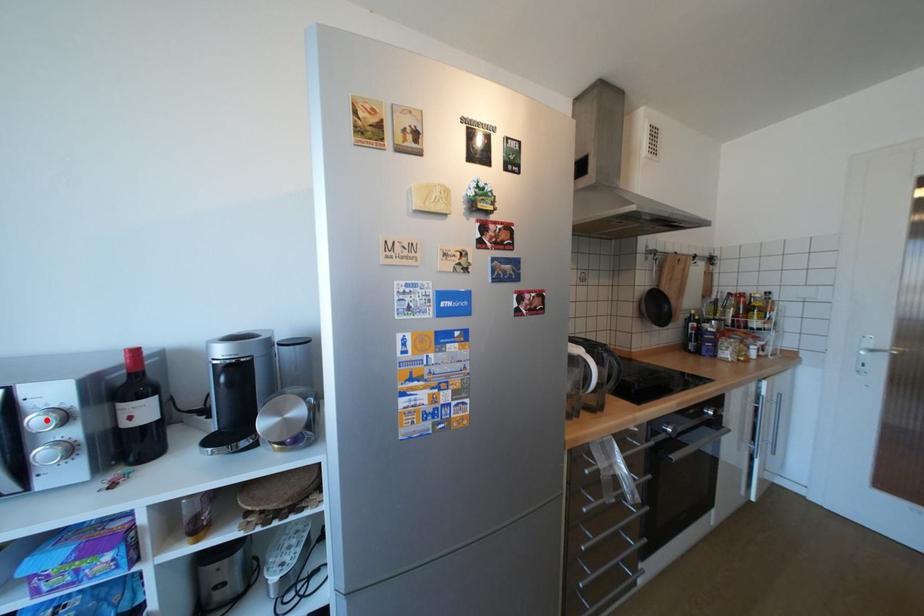
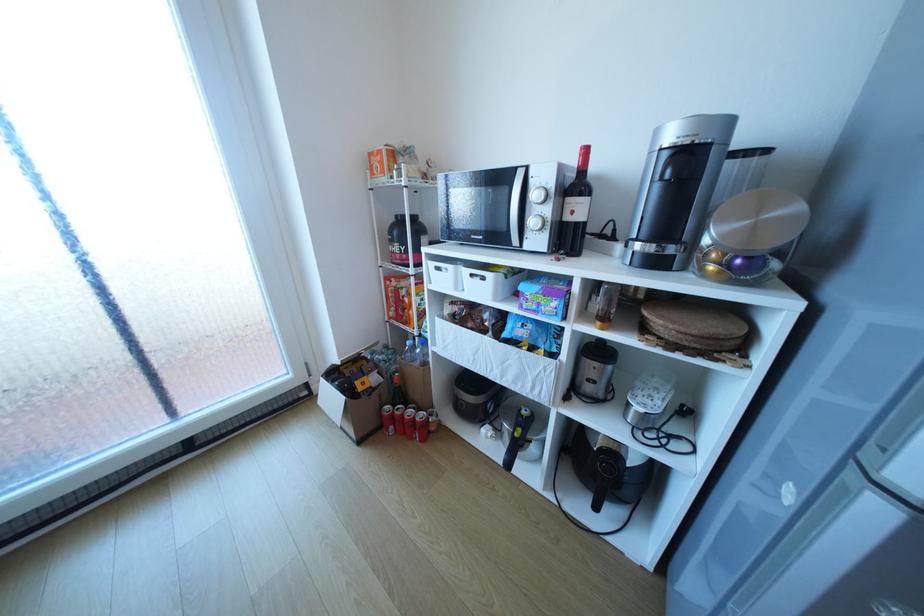
The point at the highlighted location is marked in the first image. Where is the corresponding point in the second image?

(542, 195)